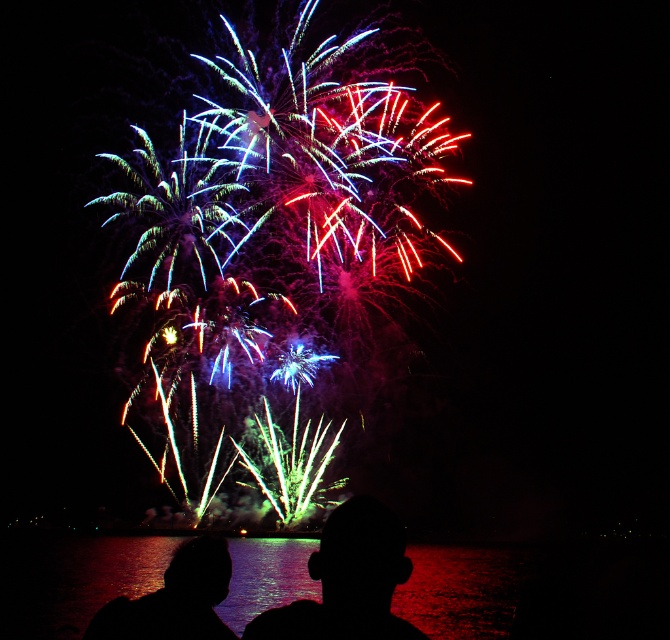
You are standing at the point with coordinates point (348, 580) and want to look at the fireworks. In which direction should you turn your head to see the fireworks display?

The point (348, 580) corresponds to the silhouette head at center, so you are already facing the fireworks display. You don not need to turn your head.

Based on the photo, you are one of the observers watching the fireworks. You notice two heads in the foreground. Which head is located higher up, the silhouette head at center or the silhouette head at lower center?

The silhouette head at center is positioned over the silhouette head at lower center, so it is higher up.